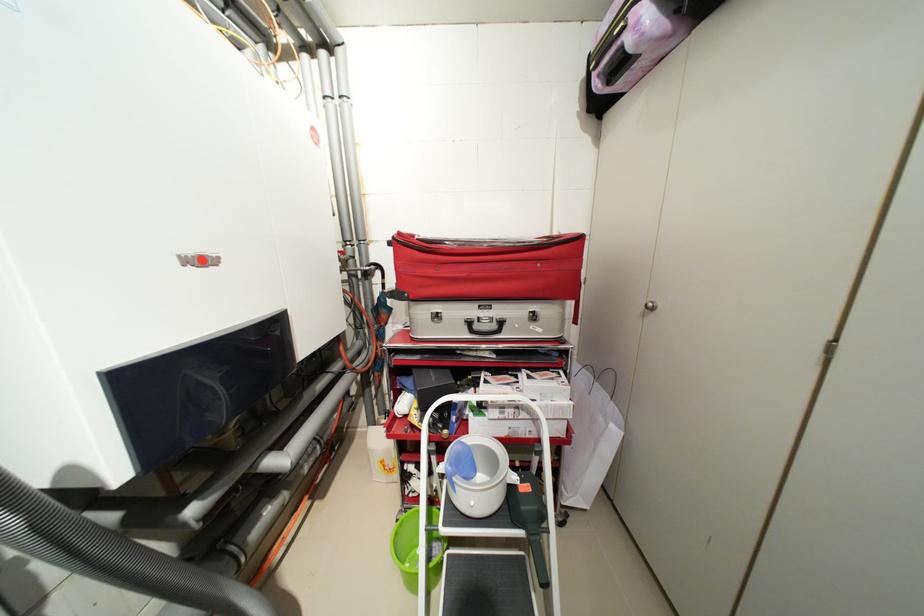
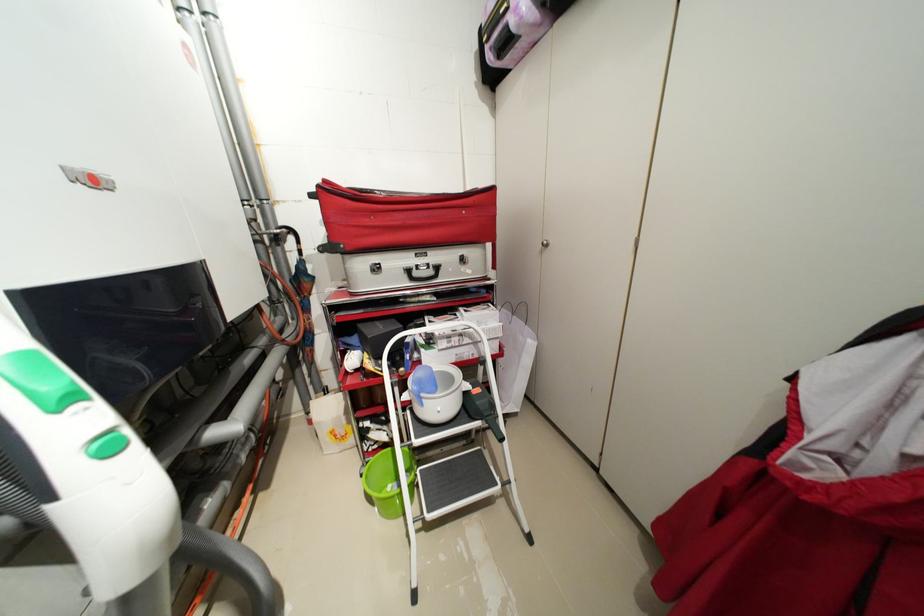
Where in the second image is the point corresponding to the point at 407,235 from the first image?

(332, 182)